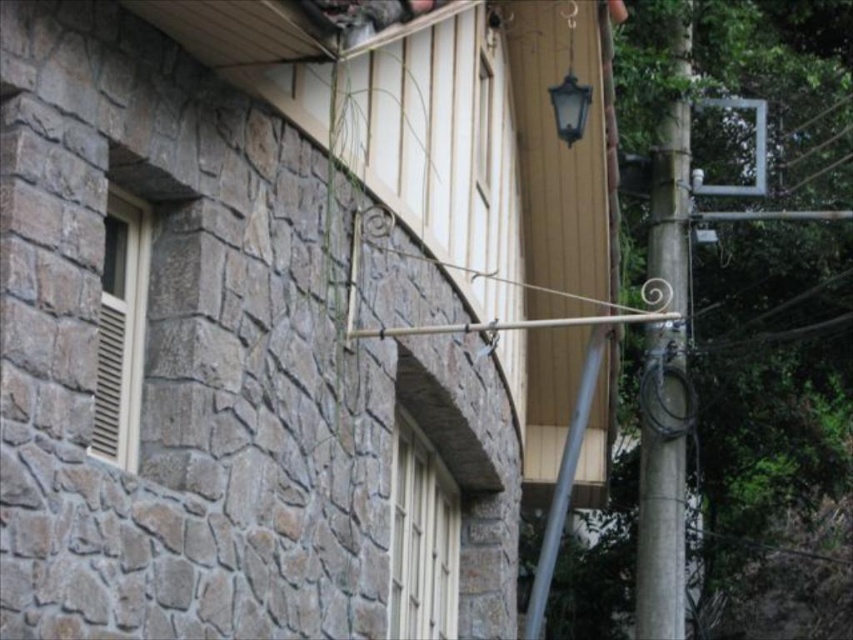
Question: Which point appears closest to the camera in this image?

Choices:
 (A) (427, 531)
 (B) (99, 378)

Answer: (B)

Question: Estimate the real-world distances between objects in this image. Which object is farther from the beige wooden window at left?

Choices:
 (A) smooth gray pole at right
 (B) white textured window at center

Answer: (A)

Question: Observing the image, what is the correct spatial positioning of smooth gray pole at right in reference to white textured window at center?

Choices:
 (A) above
 (B) below

Answer: (A)

Question: Does white textured window at center have a smaller size compared to beige wooden window at left?

Choices:
 (A) yes
 (B) no

Answer: (B)

Question: Which point is farther from the camera taking this photo?

Choices:
 (A) (682, 211)
 (B) (407, 628)
 (C) (138, 356)

Answer: (A)

Question: Is smooth gray pole at right behind white textured window at center?

Choices:
 (A) yes
 (B) no

Answer: (A)